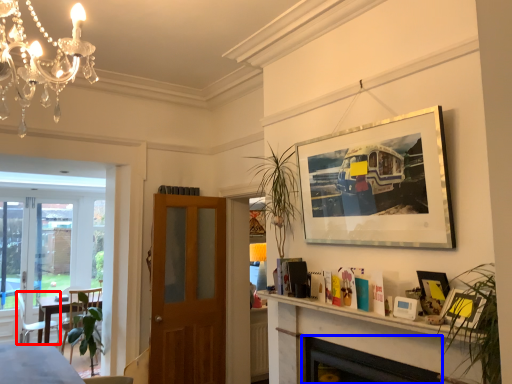
Question: Among these objects, which one is nearest to the camera, chair (highlighted by a red box) or fireplace (highlighted by a blue box)?

Choices:
 (A) chair
 (B) fireplace

Answer: (B)